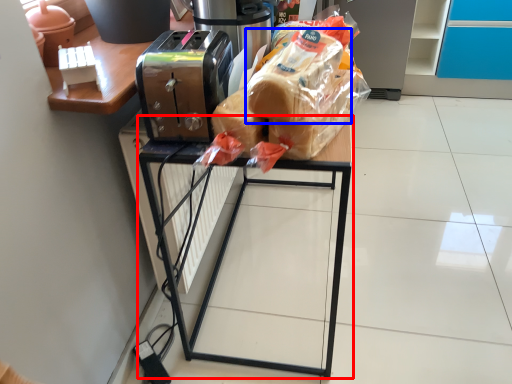
Question: Which point is further to the camera, furniture (highlighted by a red box) or bread (highlighted by a blue box)?

Choices:
 (A) furniture
 (B) bread

Answer: (A)